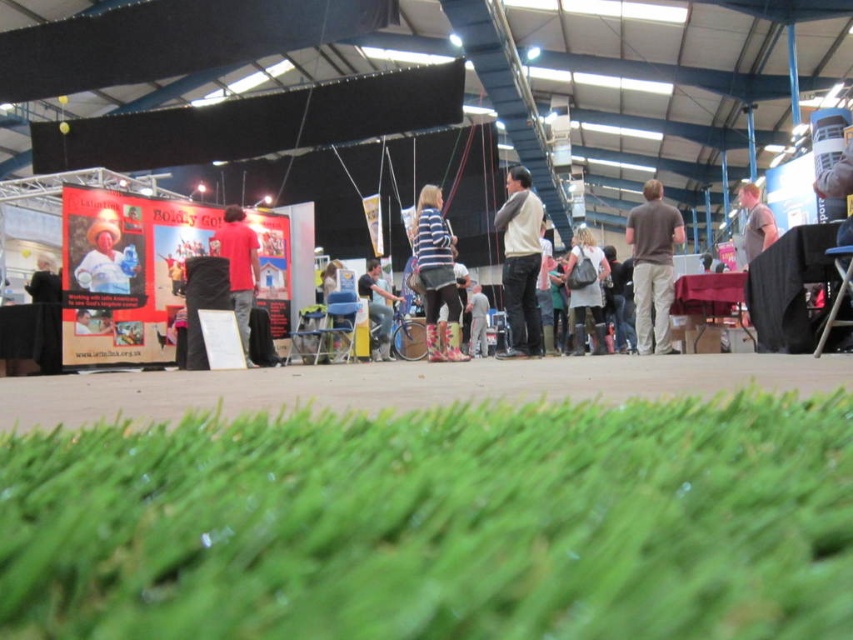
You are standing at the entrance of the exhibition hall and want to reach the point marked as point (601,346). If your walking speed is 3 feet per second, how many seconds will it take you to reach that point?

The distance of point (601,346) from viewer is 31.01 feet. At a speed of 3 feet per second, it will take approximately 10.34 seconds to reach the point.

You are a photographer setting up for an event. You need to decide whether the brown cotton shirt at center and the light brown leather jacket at right can fit side by side on a 1.2 meter wide backdrop. Based on their widths, can they both fit?

The brown cotton shirt at center might be wider than light brown leather jacket at right. If the shirt is wider than the jacket, their combined width could exceed 1.2 meters, so they might not fit. However, if the shirt is not significantly wider, there might be enough space. More information about their exact widths is needed to determine for sure.